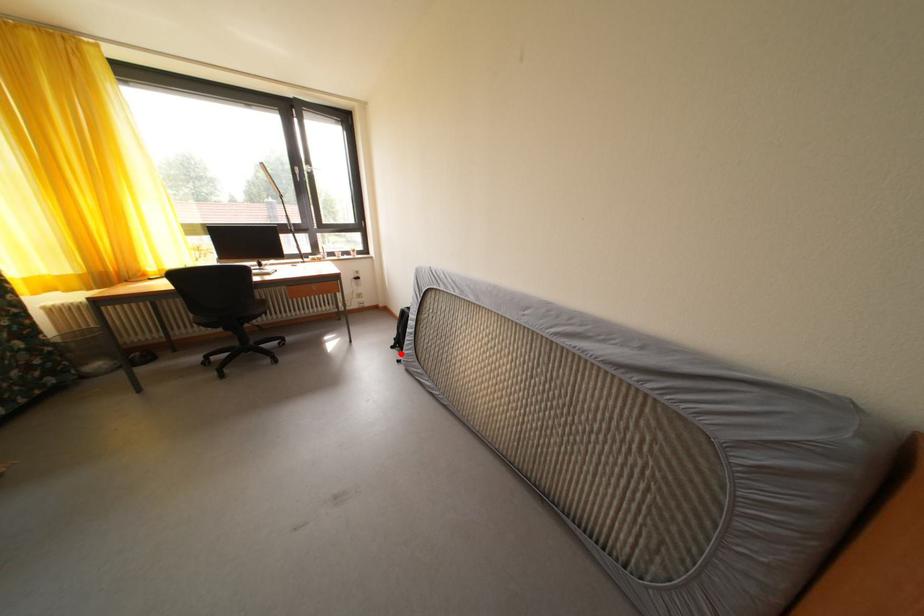
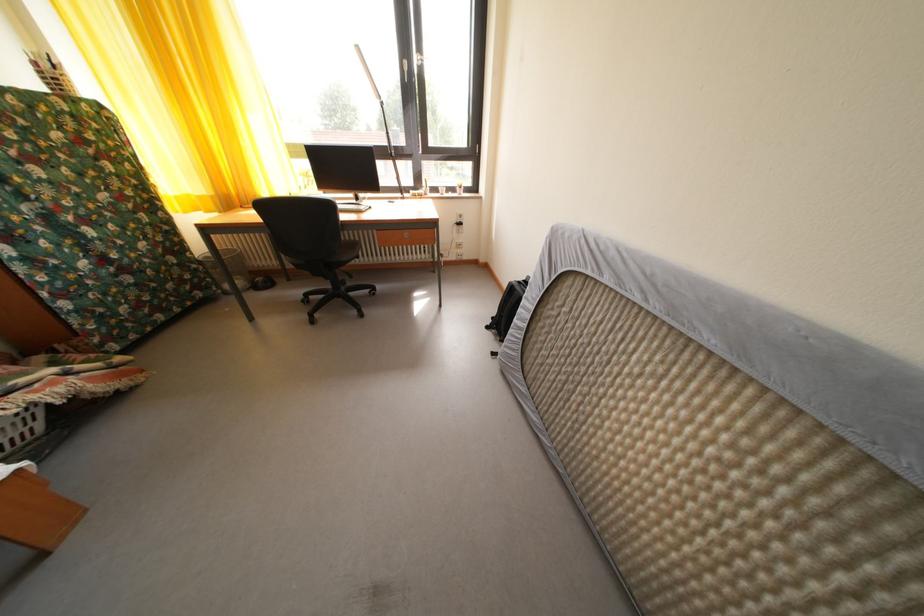
Question: I am providing you with two images of the same scene from different viewpoints. Given a red point in image1, look at the same physical point in image2. Is it:

Choices:
 (A) Closer to the viewpoint
 (B) Farther from the viewpoint

Answer: (A)